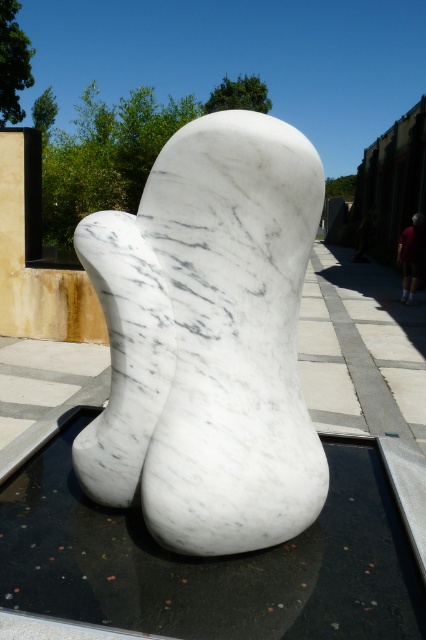
Question: Which of the following is the closest to the observer?

Choices:
 (A) (233, 330)
 (B) (420, 234)

Answer: (A)

Question: Which point is closer to the camera?

Choices:
 (A) (408, 260)
 (B) (155, 612)

Answer: (B)

Question: Is white marble water at center to the right of dark blue jeans at right from the viewer's perspective?

Choices:
 (A) yes
 (B) no

Answer: (B)

Question: Can you confirm if white marble water at center is wider than dark blue jeans at right?

Choices:
 (A) no
 (B) yes

Answer: (B)

Question: Which is nearer to the white marble water at center?

Choices:
 (A) dark blue jeans at right
 (B) white marble sculpture at center

Answer: (B)

Question: Is white marble water at center behind dark blue jeans at right?

Choices:
 (A) no
 (B) yes

Answer: (A)